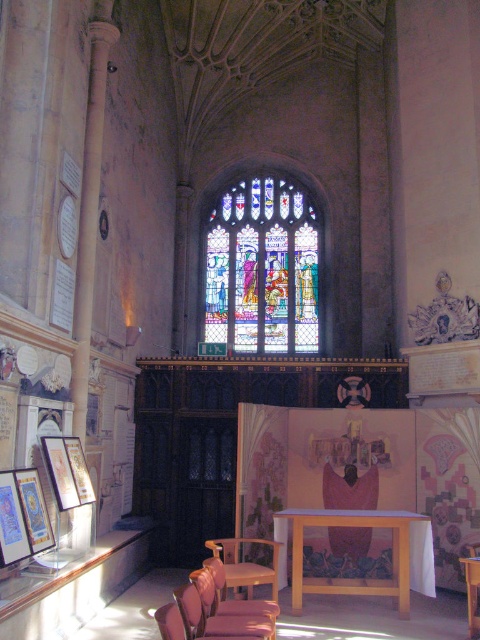
Which is below, light wood table at center or matte wooden picture frame at lower left?

light wood table at center is lower down.

Can you confirm if light wood table at center is bigger than matte wooden picture frame at lower left?

Yes, light wood table at center is bigger than matte wooden picture frame at lower left.

Which is behind, point (398, 611) or point (19, 541)?

Positioned behind is point (398, 611).

Image resolution: width=480 pixels, height=640 pixels. In order to click on light wood table at center in this screenshot , I will do `click(360, 577)`.

Can you confirm if stained glass window at center is smaller than wooden polished chair at lower center?

Incorrect, stained glass window at center is not smaller in size than wooden polished chair at lower center.

The width and height of the screenshot is (480, 640). Describe the element at coordinates (263, 268) in the screenshot. I see `stained glass window at center` at that location.

The image size is (480, 640). In order to click on stained glass window at center in this screenshot , I will do `click(263, 268)`.

Between point (219, 248) and point (172, 616), which one is positioned in front?

Point (172, 616) is in front.

Is stained glass window at center above leather cushioned chair at lower center?

Yes.

Between point (276, 344) and point (181, 621), which one is positioned behind?

The point (276, 344) is behind.

This screenshot has width=480, height=640. What are the coordinates of `stained glass window at center` in the screenshot? It's located at pos(263,268).